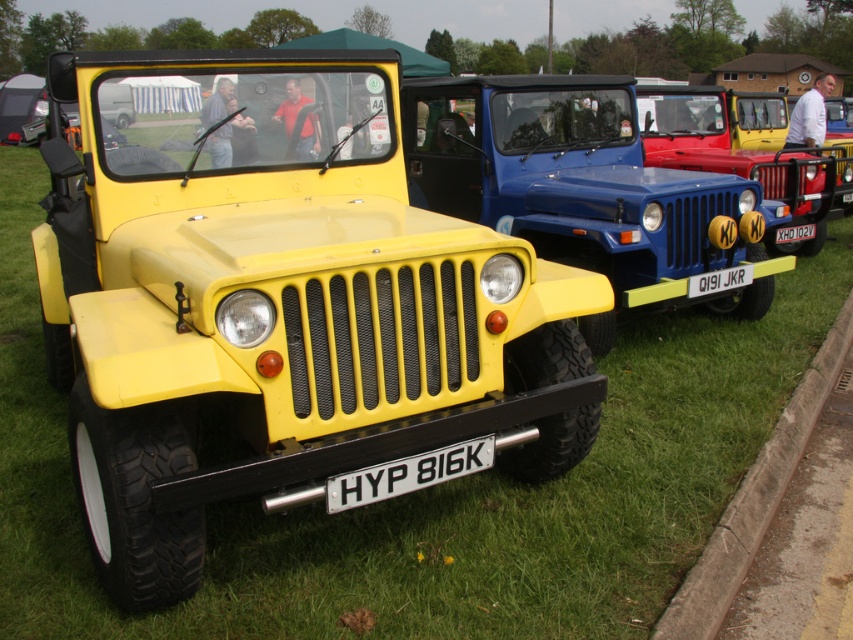
Is matte yellow jeep at center above white plastic license plate at center?

Indeed, matte yellow jeep at center is positioned over white plastic license plate at center.

Who is more forward, (593, 109) or (688, 285)?

Point (688, 285) is more forward.

Which is behind, point (608, 244) or point (718, 291)?

Positioned behind is point (718, 291).

The width and height of the screenshot is (853, 640). In order to click on matte yellow jeep at center in this screenshot , I will do `click(577, 182)`.

Does matte yellow jeep at center appear under matte blue jeep at center?

Correct, matte yellow jeep at center is located below matte blue jeep at center.

Measure the distance between matte yellow jeep at center and camera.

The distance of matte yellow jeep at center from camera is 4.60 meters.

At what (x,y) coordinates should I click in order to perform the action: click on matte yellow jeep at center. Please return your answer as a coordinate pair (x, y). Looking at the image, I should click on (577, 182).

Who is taller, matte blue jeep at center or white metallic license plate at center?

With more height is matte blue jeep at center.

The image size is (853, 640). In order to click on matte blue jeep at center in this screenshot , I will do `click(735, 148)`.

Image resolution: width=853 pixels, height=640 pixels. Find the location of `matte blue jeep at center`. matte blue jeep at center is located at coordinates pyautogui.click(x=735, y=148).